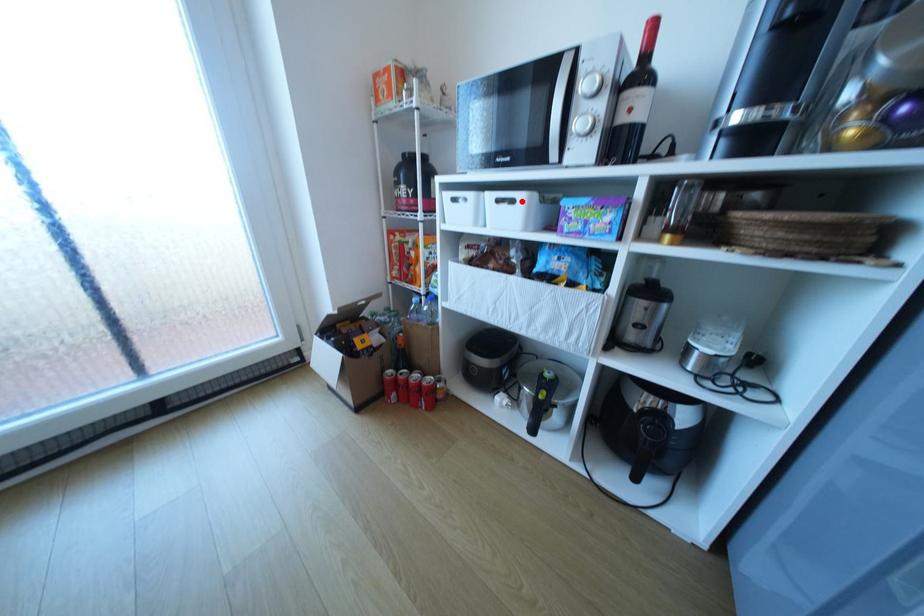
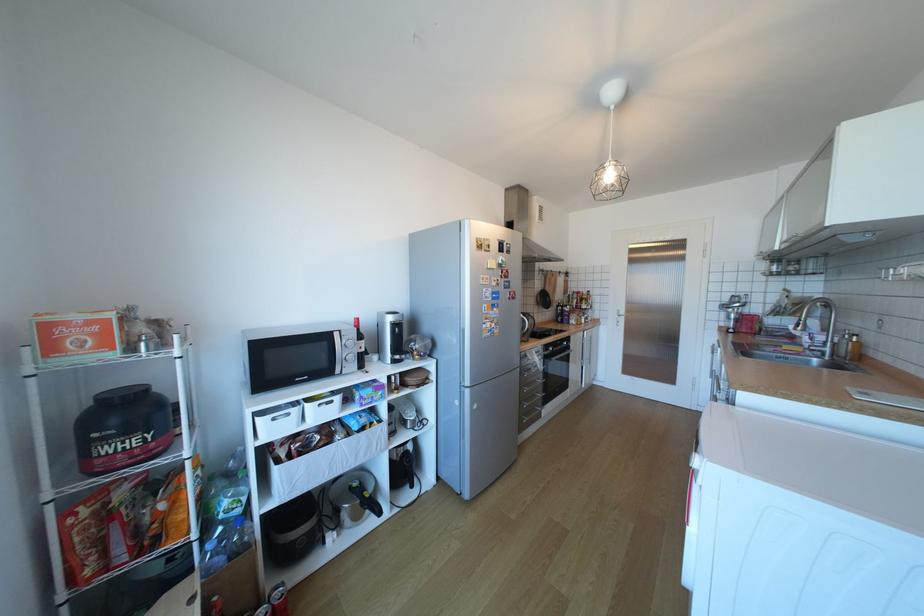
Where in the second image is the point corresponding to the highlighted location from the first image?

(341, 402)